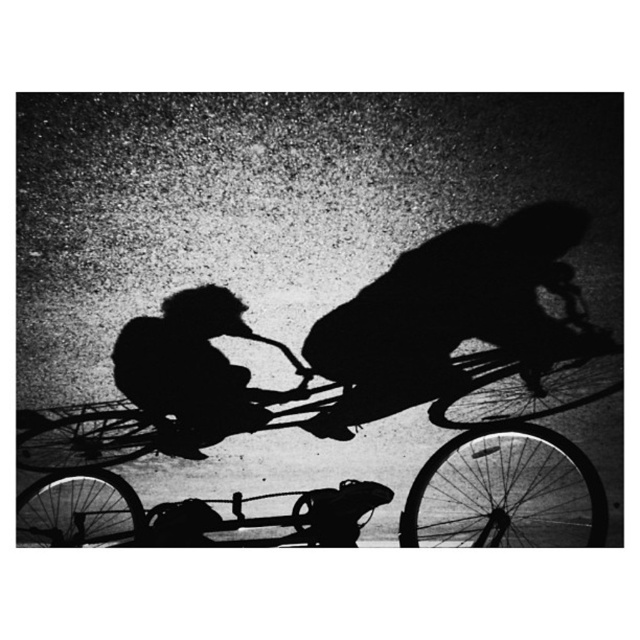
Consider the image. You are a photographer analyzing this black and white photo. You notice two cyclists at the center. Which one, the black matte bicycle rider at center or the silhouette cyclist at center, appears closer to the camera based on their size?

The black matte bicycle rider at center appears closer to the camera because it is larger in size than the silhouette cyclist at center.

You are a photographer analyzing the composition of this black and white photo. You notice two cyclists at the center. Which cyclist, the black matte bicycle rider at center or the silhouette cyclist at center, appears closer to the camera based on their positioning?

The black matte bicycle rider at center appears closer to the camera because they are positioned above the silhouette cyclist at center, which in photography often indicates a closer position due to overlapping layers.